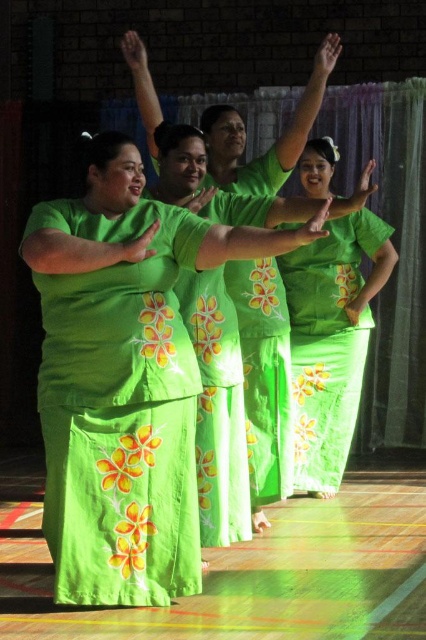
You are a photographer setting up for a dance performance. You need to ensure that the green floral skirt at center and the green satin robe at center are both visible in your shot. Given their sizes, which one requires more horizontal space in the frame?

The green floral skirt at center requires more horizontal space in the frame because its width is larger than the green satin robe at center.